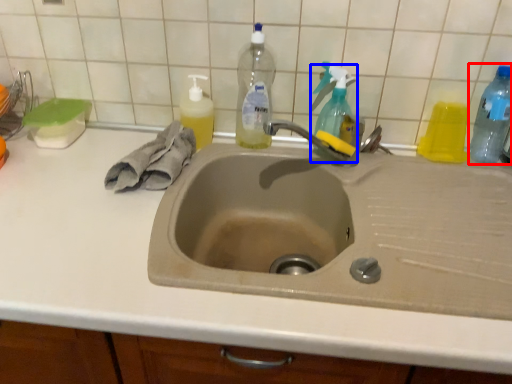
Question: Which object appears closest to the camera in this image, bottle (highlighted by a red box) or cleaning product (highlighted by a blue box)?

Choices:
 (A) bottle
 (B) cleaning product

Answer: (A)